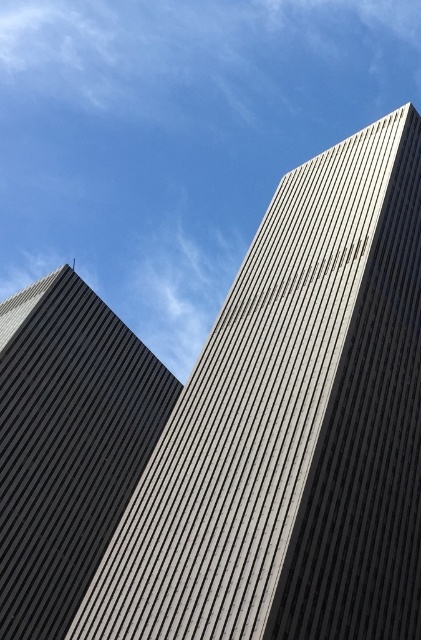
Question: Observing the image, what is the correct spatial positioning of gray textured building at center in reference to dark gray textured building at left?

Choices:
 (A) above
 (B) below

Answer: (A)

Question: Which point is farther to the camera?

Choices:
 (A) (261, 230)
 (B) (114, 355)

Answer: (B)

Question: Observing the image, what is the correct spatial positioning of gray textured building at center in reference to dark gray textured building at left?

Choices:
 (A) above
 (B) below

Answer: (A)

Question: Is gray textured building at center wider than dark gray textured building at left?

Choices:
 (A) yes
 (B) no

Answer: (A)

Question: Which point is closer to the camera?

Choices:
 (A) dark gray textured building at left
 (B) gray textured building at center

Answer: (B)